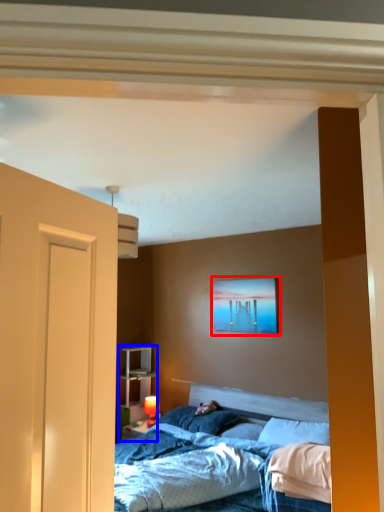
Question: Which of the following is the closest to the observer, picture frame (highlighted by a red box) or dresser (highlighted by a blue box)?

Choices:
 (A) picture frame
 (B) dresser

Answer: (A)